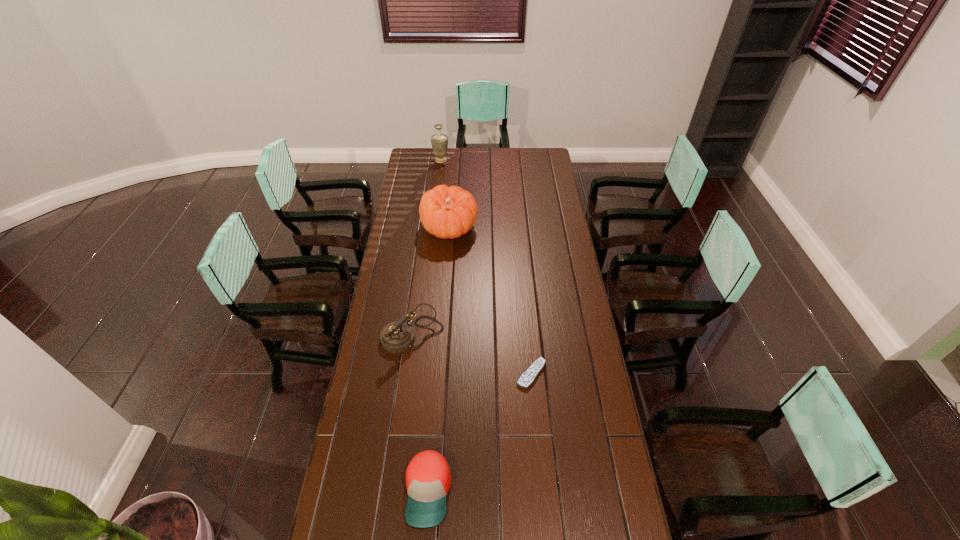
The width and height of the screenshot is (960, 540). I want to click on vacant space located 0.250m on the right of the third nearest object, so click(505, 336).

Image resolution: width=960 pixels, height=540 pixels. I want to click on vacant space situated on the left of the rightmost object, so click(479, 374).

The image size is (960, 540). In order to click on object located at the far edge in this screenshot , I will do `click(439, 141)`.

In order to click on urn situated at the left edge in this screenshot , I will do `click(439, 141)`.

The width and height of the screenshot is (960, 540). What are the coordinates of `pumpkin that is at the left edge` in the screenshot? It's located at (446, 212).

Locate an element on the screen. telephone that is at the left edge is located at coordinates (396, 337).

What are the coordinates of `object at the far left corner` in the screenshot? It's located at (439, 141).

Locate an element on the screen. The image size is (960, 540). vacant space at the far edge of the desktop is located at coordinates (521, 148).

Identify the location of free space at the left edge of the desktop. Image resolution: width=960 pixels, height=540 pixels. (383, 302).

At what (x,y) coordinates should I click in order to perform the action: click on vacant space at the right edge of the desktop. Please return your answer as a coordinate pair (x, y). The image size is (960, 540). Looking at the image, I should click on (627, 536).